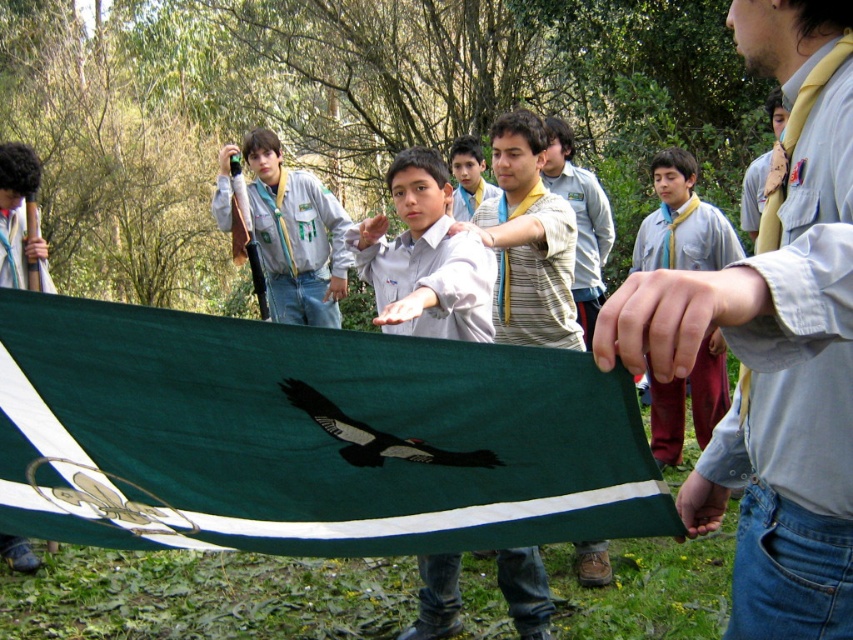
You are a member of the scouting group and need to determine the relative height of the matte yellow tie at center and the dark brown glossy eagle at center. Which object is taller?

The matte yellow tie at center is taller than the dark brown glossy eagle at center according to the description.

You are a photographer standing at the camera position. You want to take a photo of the point at coordinates point. Which object is at point? (619, 289). Is the point closer to you or farther away than 3 feet?

The point at coordinates point. (619, 289) is 34.31 inches away from the camera. Since 34.31 inches is approximately 2.86 feet, the point is closer to you than 3 feet.